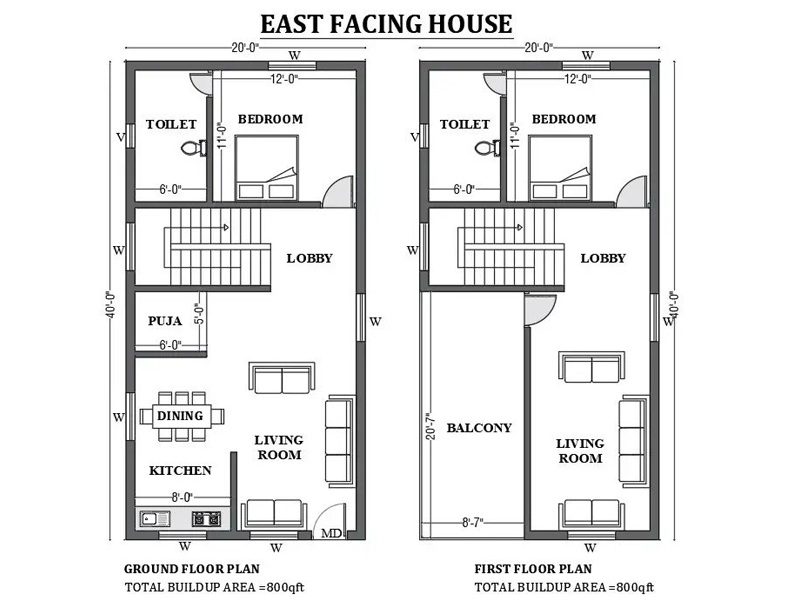
Identify the location of doors. (536, 304), (326, 529), (334, 189), (334, 455), (206, 80), (492, 80), (634, 196).